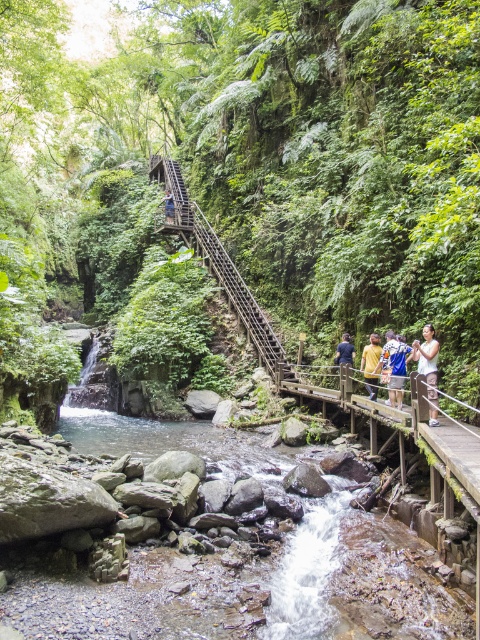
Question: Is green leafy forest at center above light brown wooden bridge at lower right?

Choices:
 (A) yes
 (B) no

Answer: (A)

Question: Among these points, which one is farthest from the camera?

Choices:
 (A) (396, 376)
 (B) (346, 336)
 (C) (279, 353)

Answer: (C)

Question: Which object is closer to the camera taking this photo?

Choices:
 (A) yellow fabric shirt at center-right
 (B) wooden bridge at center
 (C) wooden staircase at upper center

Answer: (B)

Question: Among these points, which one is farthest from the camera?

Choices:
 (A) (372, 376)
 (B) (148, 141)

Answer: (B)

Question: Is wooden bridge at center wider than blue denim shorts at center?

Choices:
 (A) yes
 (B) no

Answer: (A)

Question: Does green leafy forest at center appear on the left side of wooden staircase at upper center?

Choices:
 (A) no
 (B) yes

Answer: (B)